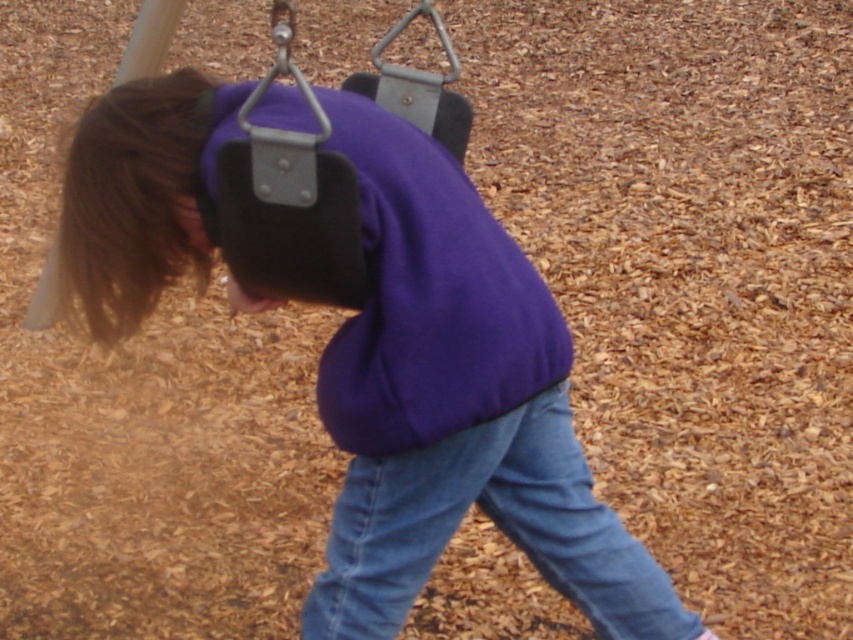
Question: Which point is farther to the camera?

Choices:
 (A) brown smooth hair at upper left
 (B) purple matte sweatshirt at center
 (C) metallic swing at center
 (D) denim at lower center

Answer: (C)

Question: Can you confirm if purple matte sweatshirt at center is positioned above brown smooth hair at upper left?

Choices:
 (A) yes
 (B) no

Answer: (B)

Question: Can you confirm if brown smooth hair at upper left is thinner than metallic swing at center?

Choices:
 (A) yes
 (B) no

Answer: (B)

Question: Does denim at lower center appear under brown smooth hair at upper left?

Choices:
 (A) no
 (B) yes

Answer: (B)

Question: Which point is farther from the camera taking this photo?

Choices:
 (A) (366, 404)
 (B) (202, 112)

Answer: (B)

Question: Among these points, which one is farthest from the camera?

Choices:
 (A) (392, 276)
 (B) (509, 516)
 (C) (132, 204)
 (D) (155, 28)

Answer: (D)